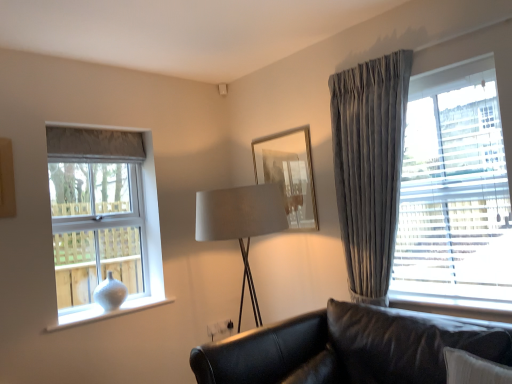
Question: Is white matte vase at left, which is the second window in front-to-back order, turned away from velvet gray curtain at right, positioned as the second window in back-to-front order?

Choices:
 (A) no
 (B) yes

Answer: (A)

Question: Is white matte vase at left, the second window positioned from the right, outside velvet gray curtain at right, which is the 1th window in right-to-left order?

Choices:
 (A) no
 (B) yes

Answer: (B)

Question: Considering the relative sizes of white matte vase at left, the first window from the back, and velvet gray curtain at right, positioned as the second window in back-to-front order, in the image provided, is white matte vase at left, the first window from the back, thinner than velvet gray curtain at right, positioned as the second window in back-to-front order,?

Choices:
 (A) yes
 (B) no

Answer: (B)

Question: From the image's perspective, would you say white matte vase at left, which is the second window in front-to-back order, is shown under velvet gray curtain at right, placed as the first window when sorted from front to back?

Choices:
 (A) no
 (B) yes

Answer: (B)

Question: Is white matte vase at left, the second window positioned from the right, closer to camera compared to velvet gray curtain at right, which is the 1th window in right-to-left order?

Choices:
 (A) no
 (B) yes

Answer: (A)

Question: Considering the relative sizes of white matte vase at left, positioned as the 1th window in left-to-right order, and velvet gray curtain at right, placed as the first window when sorted from front to back, in the image provided, is white matte vase at left, positioned as the 1th window in left-to-right order, shorter than velvet gray curtain at right, placed as the first window when sorted from front to back,?

Choices:
 (A) yes
 (B) no

Answer: (A)

Question: Is white matte vase at left, the first window from the back, next to white glossy vase at lower left and touching it?

Choices:
 (A) no
 (B) yes

Answer: (A)

Question: Does white matte vase at left, the first window from the back, have a lesser width compared to white glossy vase at lower left?

Choices:
 (A) no
 (B) yes

Answer: (B)

Question: Does white matte vase at left, which is the second window in front-to-back order, have a larger size compared to white glossy vase at lower left?

Choices:
 (A) no
 (B) yes

Answer: (B)

Question: From a real-world perspective, is white matte vase at left, the first window from the back, positioned under white glossy vase at lower left based on gravity?

Choices:
 (A) no
 (B) yes

Answer: (A)

Question: Is white matte vase at left, the first window from the back, taller than white glossy vase at lower left?

Choices:
 (A) no
 (B) yes

Answer: (B)

Question: Is white matte vase at left, the first window from the back, in front of white glossy vase at lower left?

Choices:
 (A) yes
 (B) no

Answer: (B)

Question: Is black leather couch at lower right turned away from white matte vase at left, the first window from the back?

Choices:
 (A) no
 (B) yes

Answer: (A)